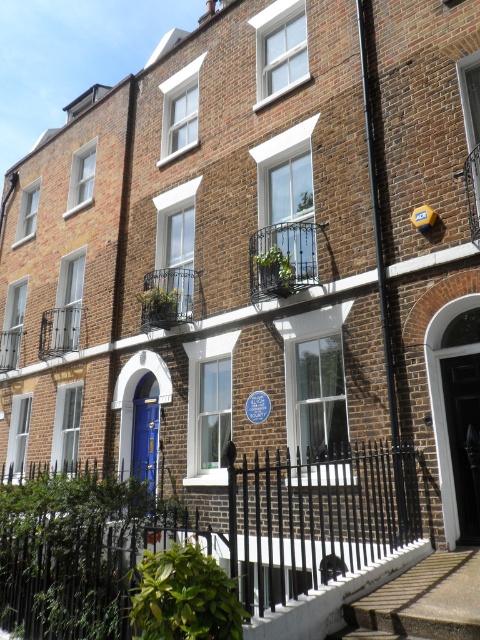
Which is above, black matte door at center or blue glossy door at center?

black matte door at center is higher up.

Does black matte door at center appear under blue glossy door at center?

No, black matte door at center is not below blue glossy door at center.

Between point (463, 518) and point (133, 433), which one is positioned in front?

Positioned in front is point (463, 518).

Find the location of a particular element. black matte door at center is located at coordinates (464, 436).

Is black wrought iron fence at center positioned at the back of black matte door at center?

No.

Is point (68, 540) closer to viewer compared to point (475, 461)?

Yes.

Where is `black wrought iron fence at center`? The width and height of the screenshot is (480, 640). black wrought iron fence at center is located at coordinates (214, 540).

Is black wrought iron fence at center thinner than blue glossy door at center?

Incorrect, black wrought iron fence at center's width is not less than blue glossy door at center's.

Does black wrought iron fence at center come in front of blue glossy door at center?

Yes, it is in front of blue glossy door at center.

Who is more distant from viewer, (305,484) or (156,413)?

The point (156,413) is more distant.

Locate an element on the screen. Image resolution: width=480 pixels, height=640 pixels. black wrought iron fence at center is located at coordinates (214, 540).